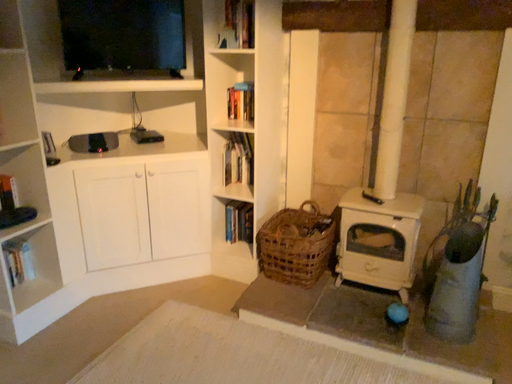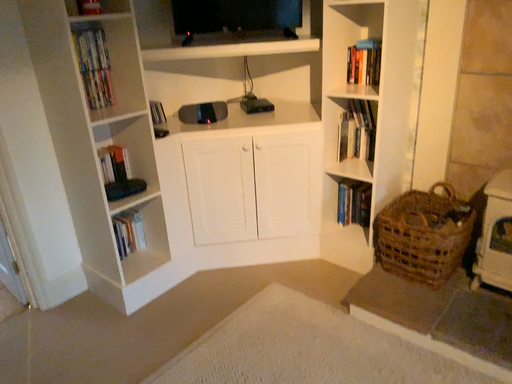
Question: Which way did the camera rotate in the video?

Choices:
 (A) rotated right
 (B) rotated left

Answer: (B)